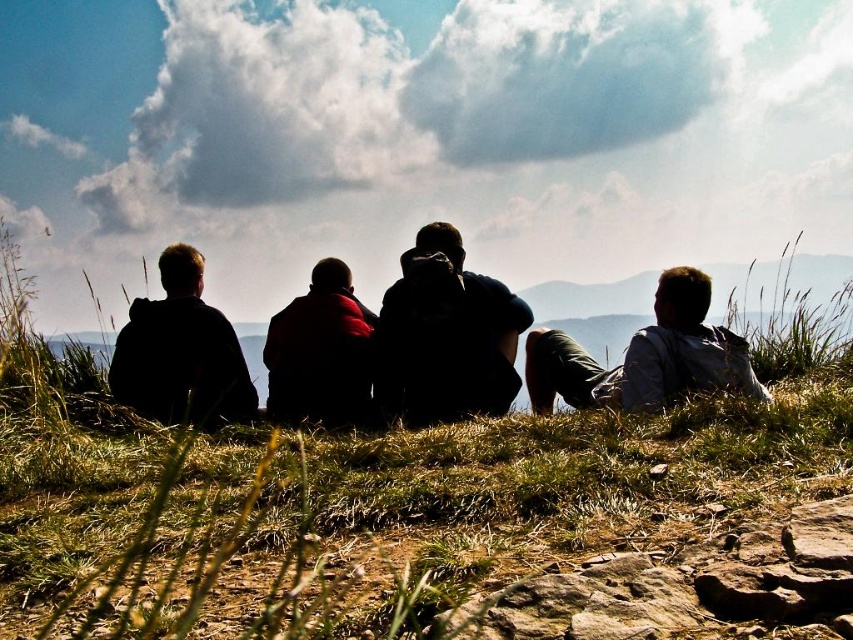
You are a photographer trying to capture a closeup of both the light gray fabric shirt at center and the red woolen sweater at center in the scene. Since you want to ensure both are in focus, you need to know which one is larger. Which object is bigger?

The light gray fabric shirt at center is bigger than the red woolen sweater at center, so you should focus on the light gray fabric shirt at center first as it requires more detailed focus due to its larger size.

You are a photographer trying to capture the two central figures in the scene. The silhouette jacket at center and the red woolen sweater at center are both in your frame. According to the description, which object is covering the other?

The silhouette jacket at center is positioned over the red woolen sweater at center, so the silhouette jacket at center is covering the red woolen sweater at center.